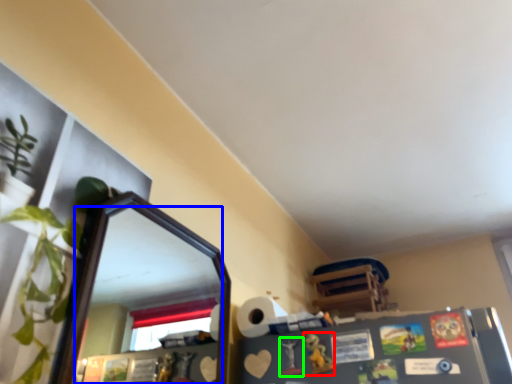
Question: Which is farther away from toy (highlighted by a red box)? mirror (highlighted by a blue box) or toy (highlighted by a green box)?

Choices:
 (A) mirror
 (B) toy

Answer: (A)